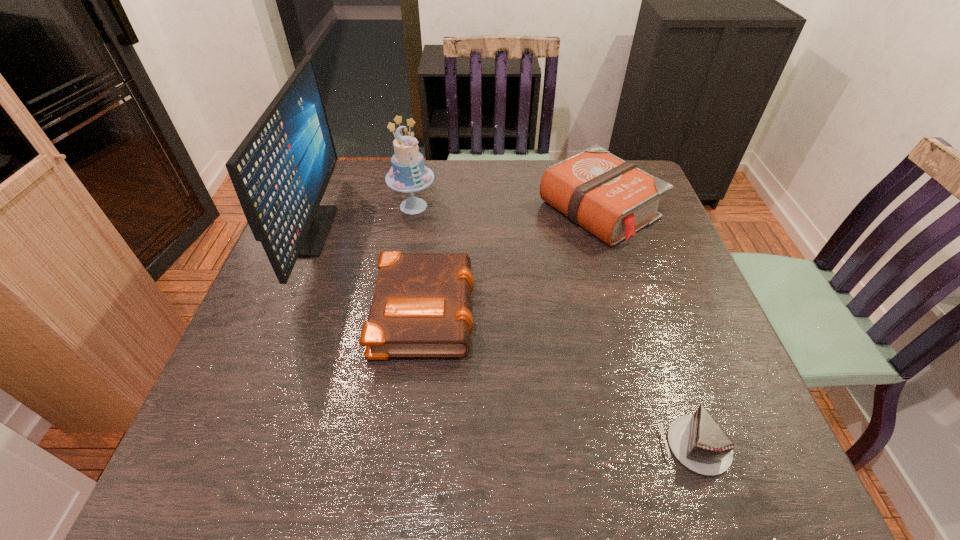
At what (x,y) coordinates should I click in order to perform the action: click on chocolate cake that is positioned at the right edge. Please return your answer as a coordinate pair (x, y). Looking at the image, I should click on (697, 441).

The height and width of the screenshot is (540, 960). Identify the location of object present at the far left corner. (280, 171).

You are a GUI agent. You are given a task and a screenshot of the screen. Output one action in this format:
    pyautogui.click(x=<x>, y=<y>)
    Task: Click on the object that is at the far right corner
    This screenshot has height=540, width=960.
    Given the screenshot: What is the action you would take?
    pyautogui.click(x=611, y=198)

Locate an element on the screen. The height and width of the screenshot is (540, 960). object that is at the near right corner is located at coordinates (697, 441).

In the image, there is a desktop. In order to click on vacant space at the far edge in this screenshot , I will do `click(480, 171)`.

In the image, there is a desktop. What are the coordinates of `vacant area at the near edge` in the screenshot? It's located at (522, 472).

Image resolution: width=960 pixels, height=540 pixels. What are the coordinates of `vacant space at the left edge of the desktop` in the screenshot? It's located at (324, 293).

This screenshot has width=960, height=540. In the image, there is a desktop. What are the coordinates of `free space at the right edge` in the screenshot? It's located at (670, 314).

Where is `vacant area at the far left corner`? The height and width of the screenshot is (540, 960). vacant area at the far left corner is located at coordinates (346, 168).

Identify the location of free spot at the near right corner of the desktop. (750, 463).